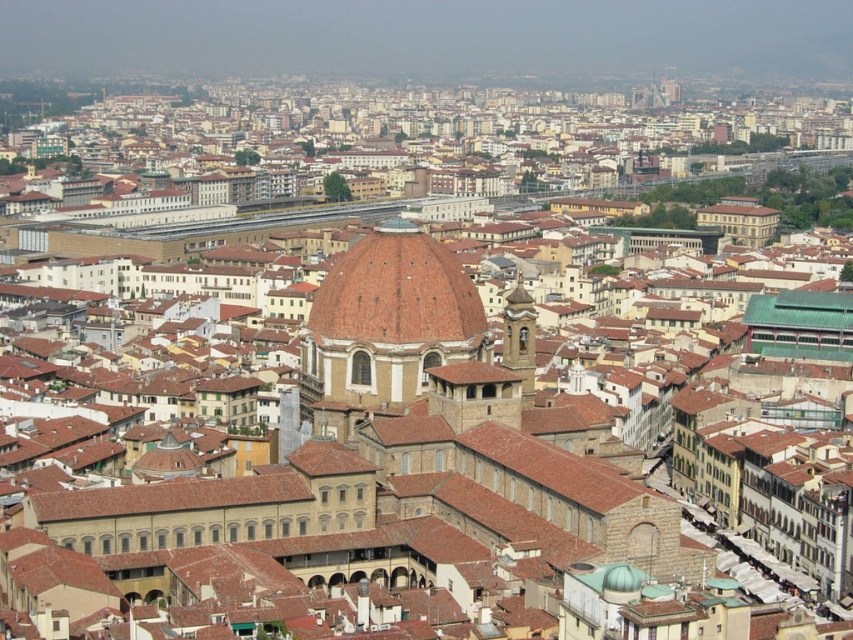
Between point (431, 237) and point (509, 292), which one is positioned in front?

Point (431, 237) is in front.

From the picture: Is brown matte dome at center in front of smooth stone bell tower at center-right?

No, it is behind smooth stone bell tower at center-right.

Is point (448, 276) positioned behind point (505, 301)?

No, it is in front of (505, 301).

The image size is (853, 640). I want to click on brown matte dome at center, so click(x=397, y=291).